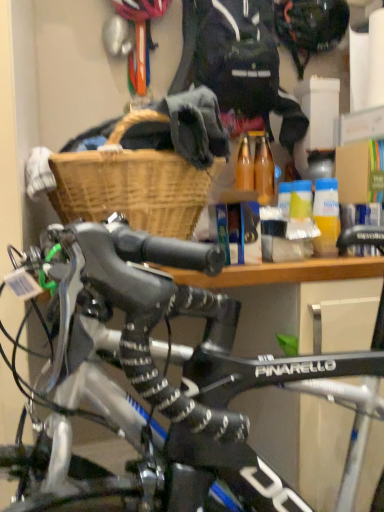
Question: Is black matte helmet at upper center beside woven wood basket at upper center?

Choices:
 (A) yes
 (B) no

Answer: (B)

Question: Is black matte helmet at upper center facing away from woven wood basket at upper center?

Choices:
 (A) no
 (B) yes

Answer: (A)

Question: Does black matte helmet at upper center have a greater height compared to woven wood basket at upper center?

Choices:
 (A) no
 (B) yes

Answer: (A)

Question: From a real-world perspective, is black matte helmet at upper center on woven wood basket at upper center?

Choices:
 (A) yes
 (B) no

Answer: (A)

Question: Can you confirm if black matte helmet at upper center is bigger than woven wood basket at upper center?

Choices:
 (A) no
 (B) yes

Answer: (A)

Question: Considering the positions of dark blue fabric jacket at upper center and black matte helmet at upper center in the image, is dark blue fabric jacket at upper center bigger or smaller than black matte helmet at upper center?

Choices:
 (A) small
 (B) big

Answer: (B)

Question: From their relative heights in the image, would you say dark blue fabric jacket at upper center is taller or shorter than black matte helmet at upper center?

Choices:
 (A) tall
 (B) short

Answer: (A)

Question: Is dark blue fabric jacket at upper center wider or thinner than black matte helmet at upper center?

Choices:
 (A) thin
 (B) wide

Answer: (B)

Question: Relative to black matte helmet at upper center, is dark blue fabric jacket at upper center in front or behind?

Choices:
 (A) behind
 (B) front

Answer: (B)

Question: Considering the relative positions of yellow matte bottle at center and dark blue fabric jacket at upper center in the image provided, is yellow matte bottle at center to the left or to the right of dark blue fabric jacket at upper center?

Choices:
 (A) left
 (B) right

Answer: (B)

Question: Considering their positions, is yellow matte bottle at center located in front of or behind dark blue fabric jacket at upper center?

Choices:
 (A) front
 (B) behind

Answer: (A)

Question: From a real-world perspective, is yellow matte bottle at center physically located above or below dark blue fabric jacket at upper center?

Choices:
 (A) above
 (B) below

Answer: (B)

Question: Based on their sizes in the image, would you say yellow matte bottle at center is bigger or smaller than dark blue fabric jacket at upper center?

Choices:
 (A) small
 (B) big

Answer: (A)

Question: From the image's perspective, is yellow matte bottle at center located above or below black matte helmet at upper center?

Choices:
 (A) above
 (B) below

Answer: (B)

Question: Is point (322, 256) closer or farther from the camera than point (306, 37)?

Choices:
 (A) closer
 (B) farther

Answer: (A)